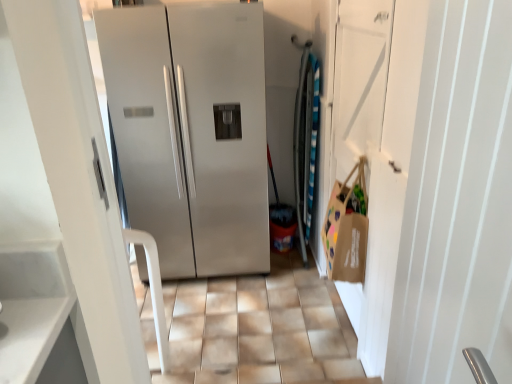
Question: Would you say brown paper bag at right is outside brown paper bag at right?

Choices:
 (A) no
 (B) yes

Answer: (B)

Question: Is brown paper bag at right oriented away from brown paper bag at right?

Choices:
 (A) yes
 (B) no

Answer: (A)

Question: Is brown paper bag at right further to the viewer compared to brown paper bag at right?

Choices:
 (A) yes
 (B) no

Answer: (A)

Question: Considering the relative sizes of brown paper bag at right and brown paper bag at right in the image provided, is brown paper bag at right thinner than brown paper bag at right?

Choices:
 (A) no
 (B) yes

Answer: (A)

Question: Can you confirm if brown paper bag at right is smaller than brown paper bag at right?

Choices:
 (A) no
 (B) yes

Answer: (B)

Question: Are brown paper bag at right and brown paper bag at right located far from each other?

Choices:
 (A) no
 (B) yes

Answer: (A)

Question: Can you confirm if satin silver refrigerator at center is positioned to the right of brown paper bag at right?

Choices:
 (A) no
 (B) yes

Answer: (A)

Question: Is satin silver refrigerator at center facing away from brown paper bag at right?

Choices:
 (A) no
 (B) yes

Answer: (A)

Question: Are satin silver refrigerator at center and brown paper bag at right beside each other?

Choices:
 (A) no
 (B) yes

Answer: (A)

Question: Does satin silver refrigerator at center have a smaller size compared to brown paper bag at right?

Choices:
 (A) no
 (B) yes

Answer: (A)

Question: From a real-world perspective, does satin silver refrigerator at center sit lower than brown paper bag at right?

Choices:
 (A) yes
 (B) no

Answer: (A)

Question: Is the depth of satin silver refrigerator at center greater than that of brown paper bag at right?

Choices:
 (A) yes
 (B) no

Answer: (A)

Question: Considering the relative positions of brown paper bag at right and satin silver refrigerator at center in the image provided, is brown paper bag at right to the right of satin silver refrigerator at center from the viewer's perspective?

Choices:
 (A) yes
 (B) no

Answer: (A)